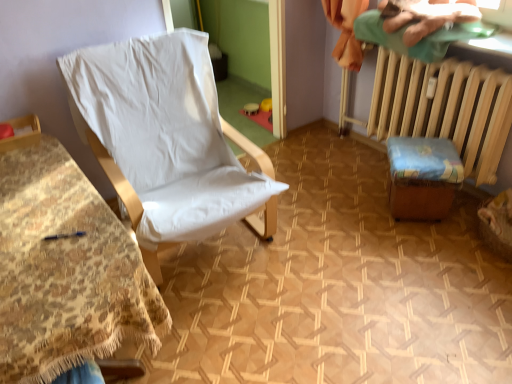
Question: Looking at their shapes, would you say white fabric chair at left, the first furniture positioned from the left, is wider or thinner than green cotton cloth at upper right?

Choices:
 (A) thin
 (B) wide

Answer: (B)

Question: Based on their positions, is white fabric chair at left, the first furniture positioned from the left, located to the left or right of green cotton cloth at upper right?

Choices:
 (A) left
 (B) right

Answer: (A)

Question: Which of these objects is positioned closest to the white fabric chair at left, the first furniture positioned from the left?

Choices:
 (A) wooden stool at lower right, the second furniture when ordered from left to right
 (B) white fabric chair at center
 (C) green cotton cloth at upper right
 (D) wooden radiator at right

Answer: (B)

Question: Which of these objects is positioned farthest from the white fabric chair at center?

Choices:
 (A) wooden radiator at right
 (B) green cotton cloth at upper right
 (C) white fabric chair at left, the second furniture from the right
 (D) wooden stool at lower right, marked as the first furniture in a right-to-left arrangement

Answer: (B)